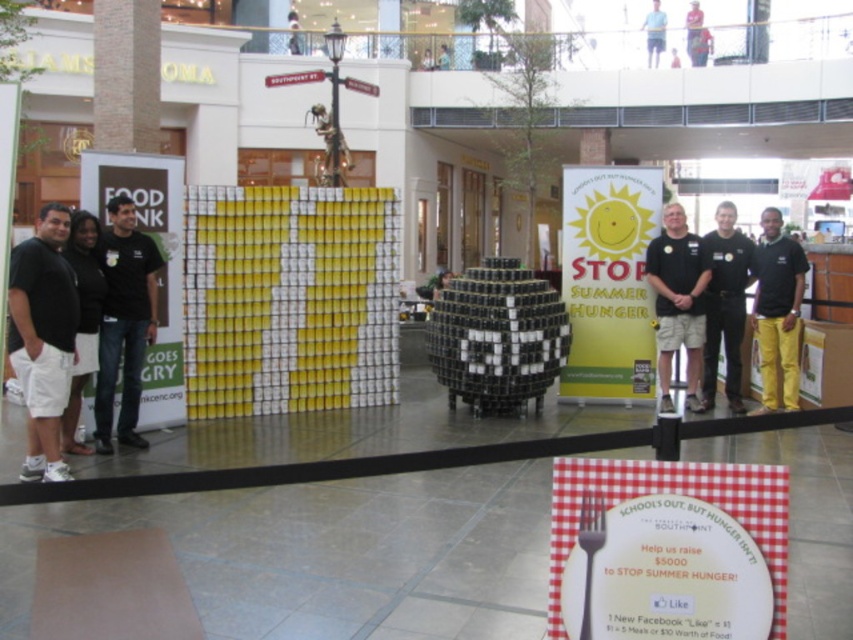
Who is positioned more to the left, black t-shirt at left or black shirt at right?

black t-shirt at left is more to the left.

Is point (102, 337) farther from camera compared to point (740, 301)?

No, (102, 337) is in front of (740, 301).

Is point (131, 369) more distant than point (730, 406)?

No.

Where is `black t-shirt at left`? The height and width of the screenshot is (640, 853). black t-shirt at left is located at coordinates (125, 323).

Based on the photo, can you confirm if black cotton shirt at center is wider than yellow matte pants at right?

Correct, the width of black cotton shirt at center exceeds that of yellow matte pants at right.

Measure the distance between black cotton shirt at center and camera.

black cotton shirt at center is 7.45 meters away from camera.

Locate an element on the screen. The image size is (853, 640). black cotton shirt at center is located at coordinates (x=677, y=301).

Is point (737, 368) positioned before point (604, 513)?

No, it is not.

Between black shirt at right and silver metallic fork at center, which one has less height?

With less height is silver metallic fork at center.

Is point (715, 349) behind point (601, 516)?

Yes, point (715, 349) is behind point (601, 516).

This screenshot has width=853, height=640. I want to click on black shirt at right, so click(724, 305).